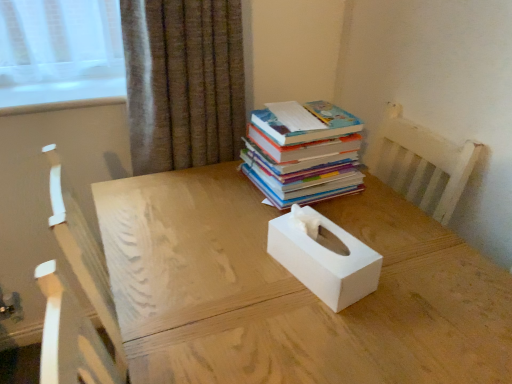
Where is `empty space that is to the right of white matte tissue box at center`? This screenshot has height=384, width=512. empty space that is to the right of white matte tissue box at center is located at coordinates (409, 273).